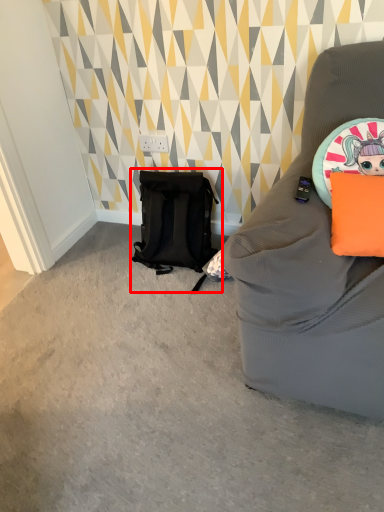
Question: Considering the relative positions of backpack (annotated by the red box) and pillow in the image provided, where is backpack (annotated by the red box) located with respect to the staircase?

Choices:
 (A) left
 (B) right

Answer: (A)